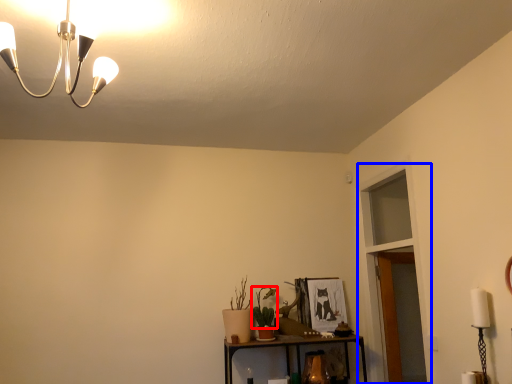
Question: Among these objects, which one is farthest to the camera, plant (highlighted by a red box) or glass door (highlighted by a blue box)?

Choices:
 (A) plant
 (B) glass door

Answer: (A)